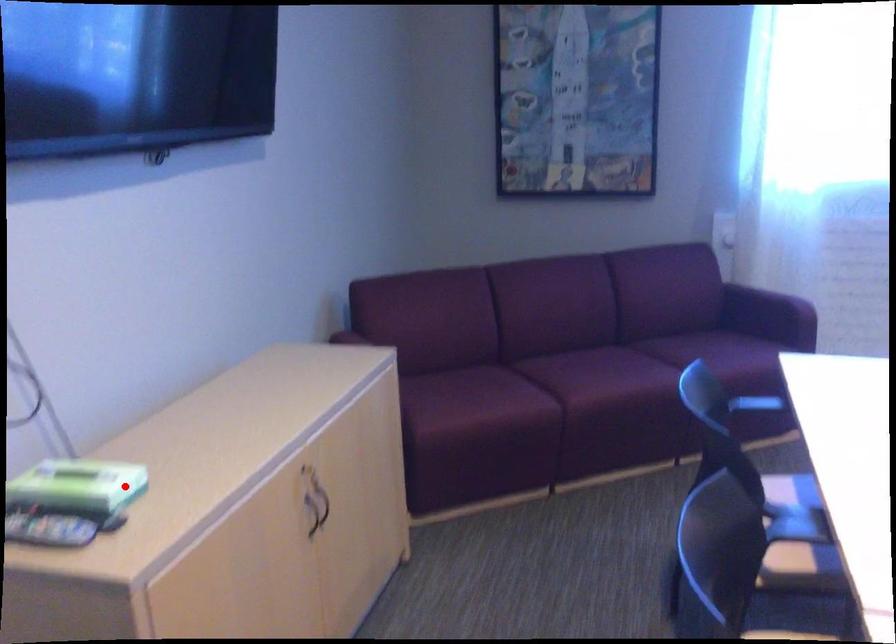
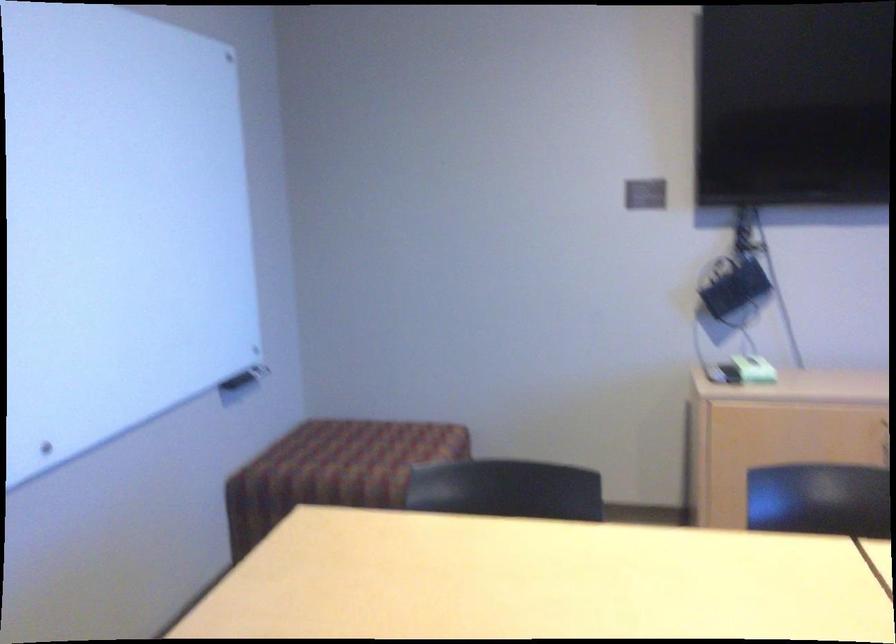
Locate, in the second image, the point that corresponds to the highlighted location in the first image.

(754, 368)